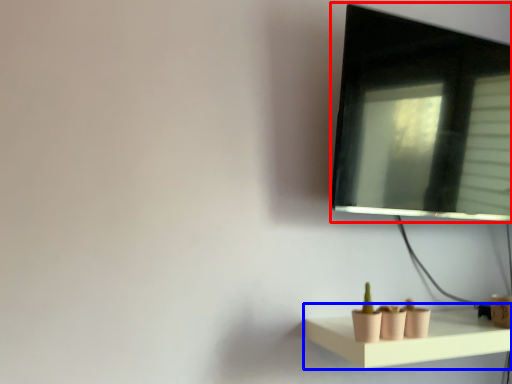
Question: Among these objects, which one is farthest to the camera, computer monitor (highlighted by a red box) or shelf (highlighted by a blue box)?

Choices:
 (A) computer monitor
 (B) shelf

Answer: (A)